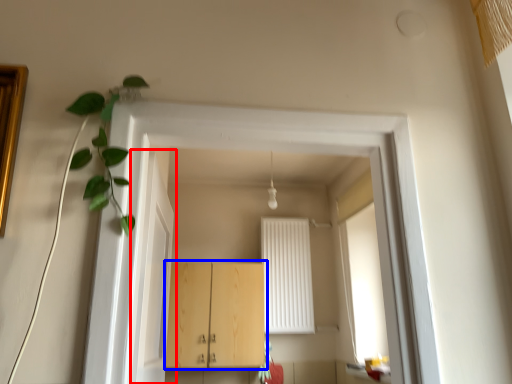
Question: Which object is closer to the camera taking this photo, door (highlighted by a red box) or cabinetry (highlighted by a blue box)?

Choices:
 (A) door
 (B) cabinetry

Answer: (A)